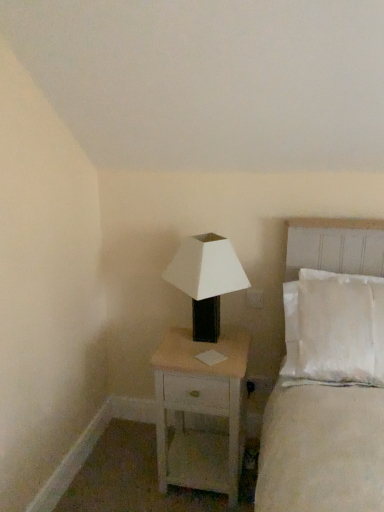
Find the location of a particular element. white matte/black textured lamp at center is located at coordinates (206, 280).

Measure the distance between white matte/black textured lamp at center and white cotton bed at right.

The distance of white matte/black textured lamp at center from white cotton bed at right is 18.54 inches.

Is white matte/black textured lamp at center next to white cotton bed at right?

No.

Is white matte/black textured lamp at center looking in the opposite direction of white cotton bed at right?

white matte/black textured lamp at center does not have its back to white cotton bed at right.

Is white cotton bed at right turned away from white wood nightstand at center?

No, white cotton bed at right is not facing away from white wood nightstand at center.

Between white cotton bed at right and white wood nightstand at center, which one has more height?

white cotton bed at right.

Can you confirm if white cotton bed at right is thinner than white wood nightstand at center?

Indeed, white cotton bed at right has a lesser width compared to white wood nightstand at center.

Between white cotton bed at right and white wood nightstand at center, which one appears on the left side from the viewer's perspective?

white wood nightstand at center is more to the left.

Is white cotton bed at right outside of white matte/black textured lamp at center?

Yes, white cotton bed at right is located beyond the bounds of white matte/black textured lamp at center.

Is white cotton bed at right to the right of white matte/black textured lamp at center from the viewer's perspective?

Correct, you'll find white cotton bed at right to the right of white matte/black textured lamp at center.

From the image's perspective, is white cotton bed at right located beneath white matte/black textured lamp at center?

Yes.

Considering the points (350, 350) and (197, 340), which point is in front, point (350, 350) or point (197, 340)?

The point (350, 350) is closer.

From the picture: Are white wood nightstand at center and white matte/black textured lamp at center beside each other?

white wood nightstand at center is not next to white matte/black textured lamp at center, and they're not touching.

Which is more to the left, white wood nightstand at center or white matte/black textured lamp at center?

From the viewer's perspective, white matte/black textured lamp at center appears more on the left side.

How many degrees apart are the facing directions of white wood nightstand at center and white matte/black textured lamp at center?

white wood nightstand at center and white matte/black textured lamp at center are facing 0.000256 degrees away from each other.

Is white wood nightstand at center taller than white matte/black textured lamp at center?

Yes.

Is white wood nightstand at center with white cotton bed at right?

No, white wood nightstand at center is not in contact with white cotton bed at right.

How many degrees apart are the facing directions of white wood nightstand at center and white cotton bed at right?

0.00056 degrees separate the facing orientations of white wood nightstand at center and white cotton bed at right.

From the image's perspective, would you say white wood nightstand at center is positioned over white cotton bed at right?

No, from the image's perspective, white wood nightstand at center is not on top of white cotton bed at right.

Is white matte/black textured lamp at center beside white wood nightstand at center?

No, white matte/black textured lamp at center is not making contact with white wood nightstand at center.

At what (x,y) coordinates should I click in order to perform the action: click on lamp located above the white wood nightstand at center (from a real-world perspective). Please return your answer as a coordinate pair (x, y). This screenshot has height=512, width=384. Looking at the image, I should click on (206, 280).

Which object is wider, white matte/black textured lamp at center or white wood nightstand at center?

white wood nightstand at center is wider.

From a real-world perspective, is white matte/black textured lamp at center positioned above or below white wood nightstand at center?

white matte/black textured lamp at center is above white wood nightstand at center.

Where is `lamp on the left of the white cotton bed at right`? lamp on the left of the white cotton bed at right is located at coordinates (206, 280).

In order to click on bed above the white wood nightstand at center (from a real-world perspective) in this screenshot , I will do `click(327, 383)`.

Looking at the image, which one is located closer to white cotton bed at right, white wood nightstand at center or white matte/black textured lamp at center?

white matte/black textured lamp at center is positioned closer to the anchor white cotton bed at right.

Based on their spatial positions, is white wood nightstand at center or white cotton bed at right further from white matte/black textured lamp at center?

Based on the image, white cotton bed at right appears to be further to white matte/black textured lamp at center.

From the image, which object appears to be farther from white matte/black textured lamp at center, white cotton bed at right or white wood nightstand at center?

Among the two, white cotton bed at right is located further to white matte/black textured lamp at center.

Which object lies further to the anchor point white wood nightstand at center, white cotton bed at right or white matte/black textured lamp at center?

Based on the image, white cotton bed at right appears to be further to white wood nightstand at center.

Considering their positions, is white matte/black textured lamp at center positioned further to white wood nightstand at center than white cotton bed at right?

white cotton bed at right.

Considering their positions, is white matte/black textured lamp at center positioned closer to white cotton bed at right than white wood nightstand at center?

white matte/black textured lamp at center.

You are a GUI agent. You are given a task and a screenshot of the screen. Output one action in this format:
    pyautogui.click(x=<x>, y=<y>)
    Task: Click on the bed between white matte/black textured lamp at center and white wood nightstand at center vertically
    The height and width of the screenshot is (512, 384).
    Given the screenshot: What is the action you would take?
    pyautogui.click(x=327, y=383)